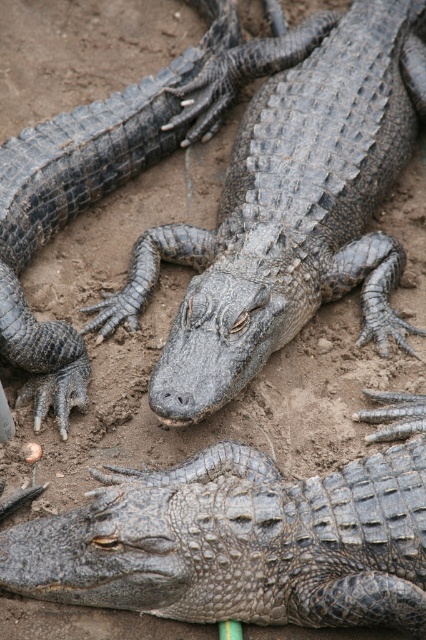
You are a wildlife photographer aiming to capture a closeup of the gray scaly crocodile at center and the gray textured crocodile at center. Since you can only focus on one at a time, which one should you choose to ensure it appears clearer in your photo?

The gray scaly crocodile at center is closer to the viewer than the gray textured crocodile at center, so focusing on it will result in a clearer image.

You are a wildlife photographer aiming to capture the tallest alligator in the scene. Given that you see the gray scaly crocodile at center and the gray textured crocodile at center, which one should you focus on to ensure you photograph the taller one?

The gray scaly crocodile at center is taller than the gray textured crocodile at center, so you should focus on the gray scaly crocodile at center to photograph the taller one.